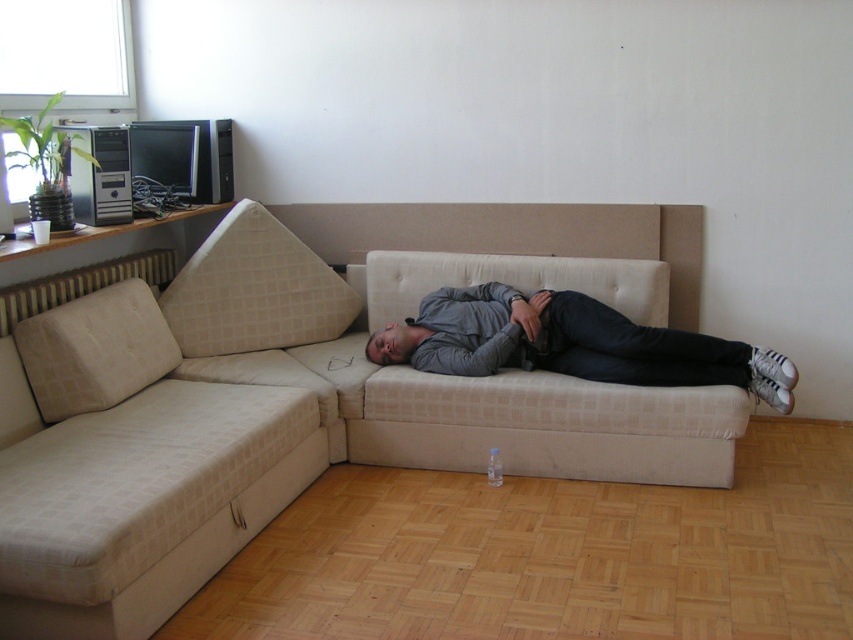
What are the coordinates of the beige fabric couch at center?

The beige fabric couch at center is located at point (302,403).

What object is located at the coordinate point (572,342) in the image?

The point (572,342) corresponds to the gray cotton shirt at center.